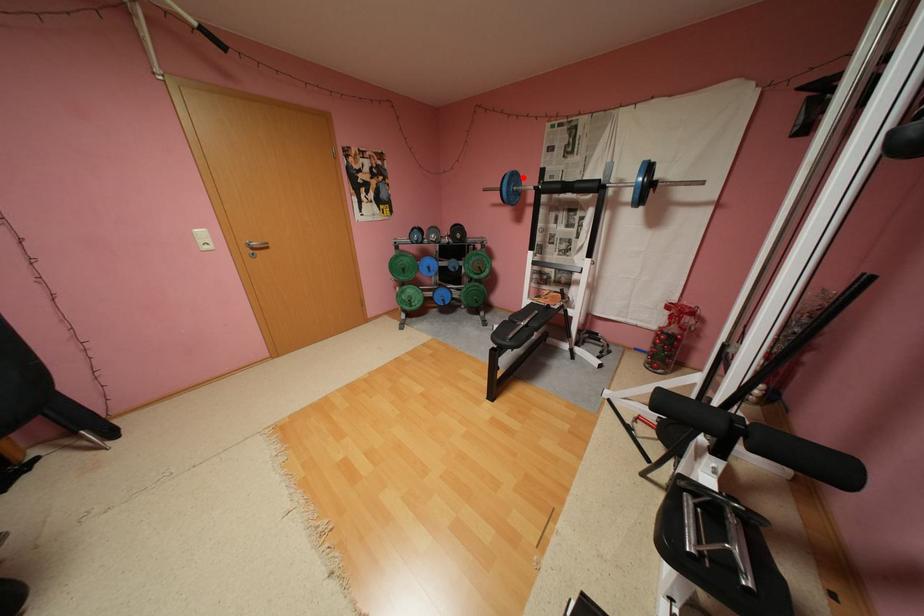
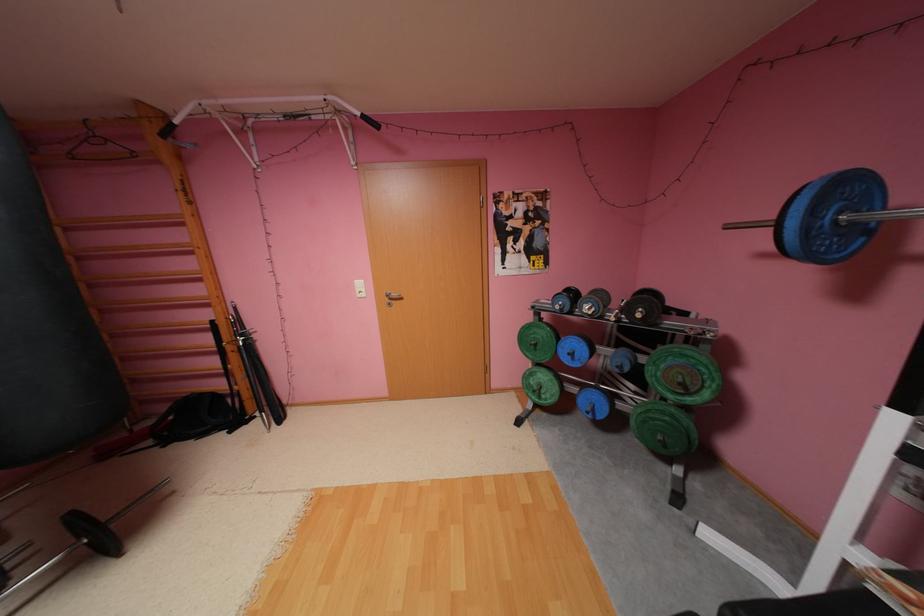
Question: I am providing you with two images of the same scene from different viewpoints. A red point is shown in image1. For the corresponding object point in image2, is it positioned nearer or farther from the camera?

Choices:
 (A) Nearer
 (B) Farther

Answer: (B)